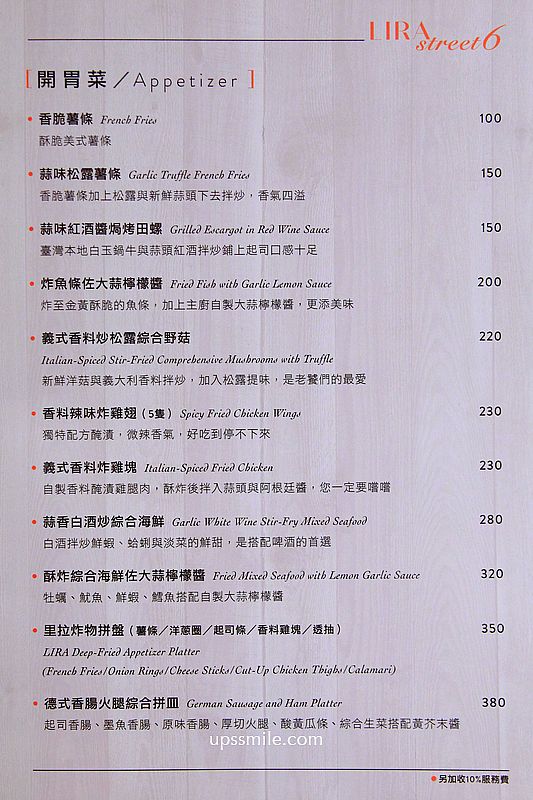
Locate an element on the screen. The width and height of the screenshot is (533, 800). corners is located at coordinates (528, 798), (526, 14).